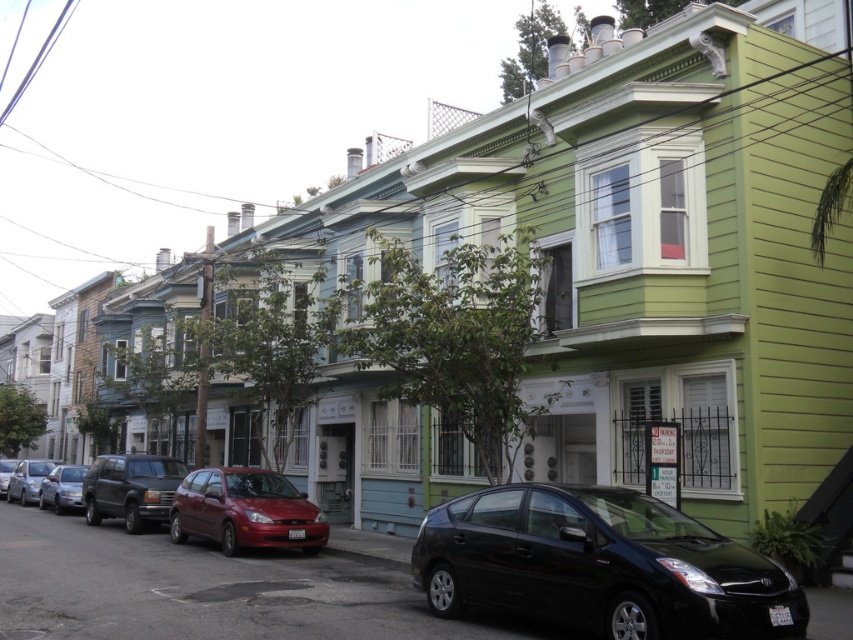
You are standing at the point labeled as point (x=601, y=564) in the image. Looking around, you see a black glossy car at lower right. What direction should you face to see the black glossy car at lower right?

You should face towards the lower right direction to see the black glossy car at lower right as it is located at lower right from your current position at point (x=601, y=564).